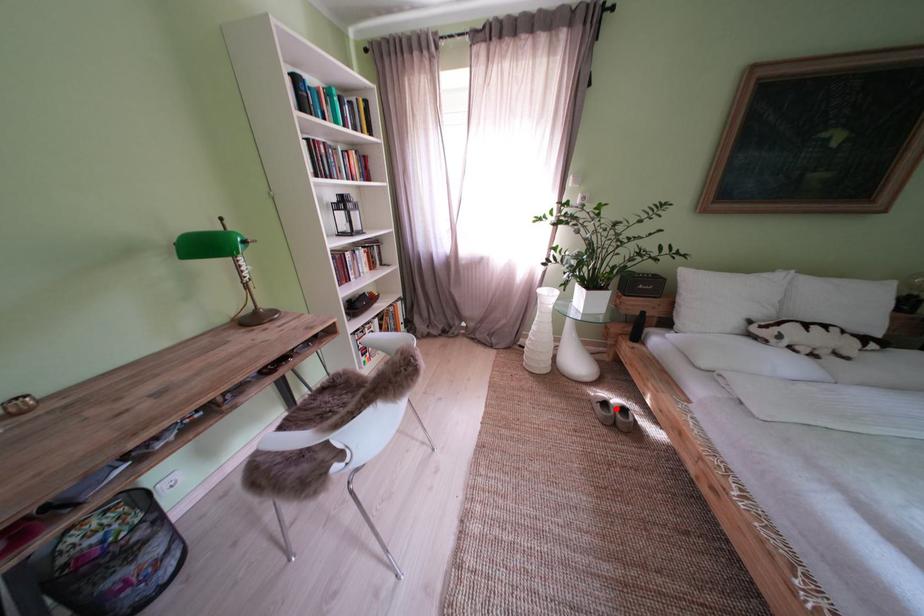
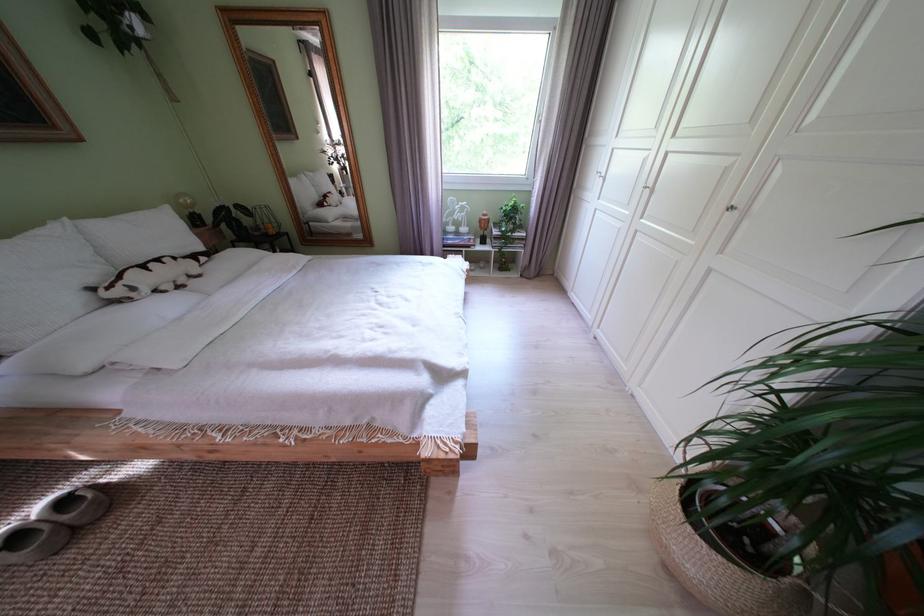
In the second image, find the point that corresponds to the highlighted location in the first image.

(28, 543)